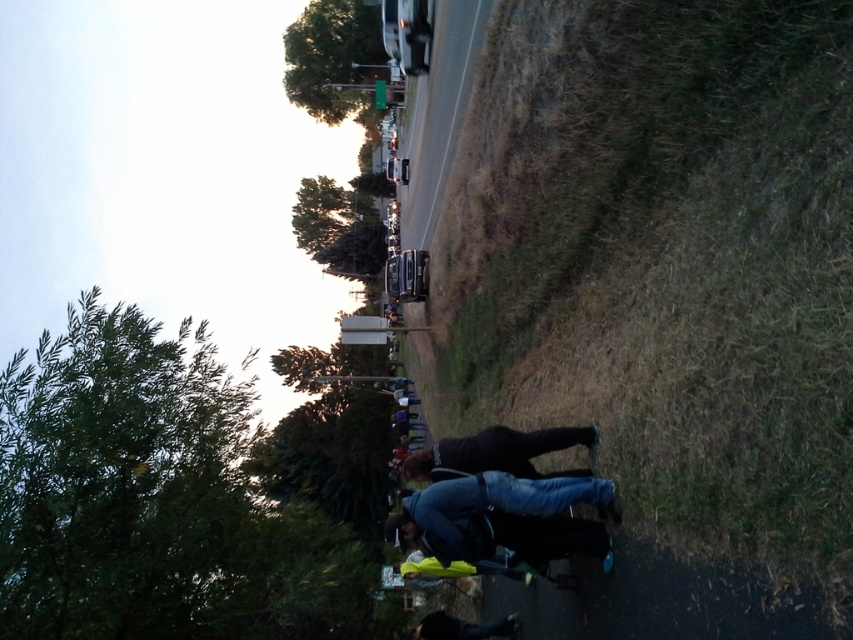
You are standing on the paved path and want to move from your current position to the dark gray smooth skateboard at center without stepping on the dark blue denim jeans at lower center. Is this possible?

The dark blue denim jeans at lower center is in front of the dark gray smooth skateboard at center, so you cannot avoid stepping on the dark blue denim jeans at lower center if you want to reach the dark gray smooth skateboard at center.

You are a photographer trying to capture a photo where both the dry grass at right and the dark blue denim jeans at lower center are in focus. Based on the scene description, what is the minimum distance you need to set your camera lens to ensure both objects are in focus?

The dry grass at right and dark blue denim jeans at lower center are 6.85 feet apart from each other. To ensure both are in focus, the camera lens should be set to a distance that accommodates this depth of field, typically around the midpoint between the two objects or using a small aperture for greater depth of field.